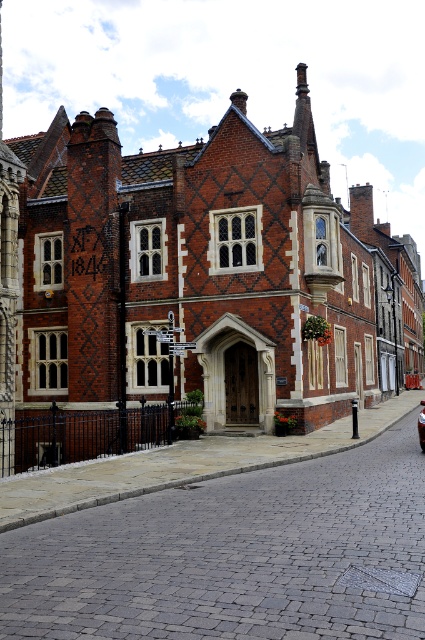
Question: Among these points, which one is nearest to the camera?

Choices:
 (A) (421, 412)
 (B) (181, 337)

Answer: (B)

Question: Is brick building at center smaller than shiny red car at center?

Choices:
 (A) no
 (B) yes

Answer: (A)

Question: Does brick building at center lie in front of shiny red car at center?

Choices:
 (A) yes
 (B) no

Answer: (B)

Question: Which point is closer to the camera taking this photo?

Choices:
 (A) (206, 179)
 (B) (424, 438)

Answer: (B)

Question: Can you confirm if brick building at center is positioned above shiny red car at center?

Choices:
 (A) yes
 (B) no

Answer: (A)